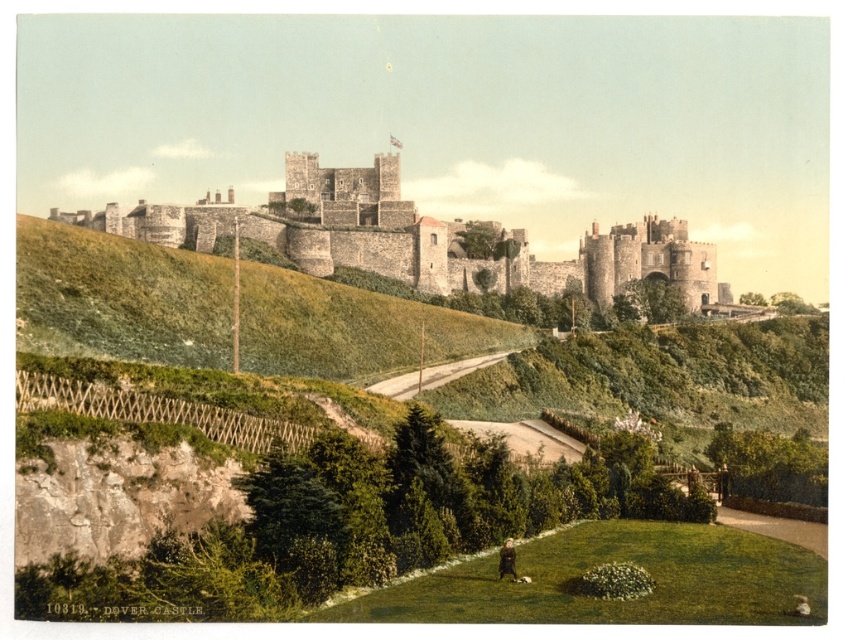
Is green grassy hillside at upper center behind stone castle at center?

No, it is not.

Who is higher up, green grassy hillside at upper center or stone castle at center?

Positioned higher is stone castle at center.

Identify the location of green grassy hillside at upper center. (120, 298).

Locate an element on the screen. green grassy hillside at upper center is located at coordinates (120, 298).

Can you confirm if green grassy hillside at upper center is taller than brown fur dog at lower center?

Indeed, green grassy hillside at upper center has a greater height compared to brown fur dog at lower center.

This screenshot has width=848, height=640. What do you see at coordinates (120, 298) in the screenshot? I see `green grassy hillside at upper center` at bounding box center [120, 298].

This screenshot has width=848, height=640. Find the location of `green grassy hillside at upper center`. green grassy hillside at upper center is located at coordinates (120, 298).

Image resolution: width=848 pixels, height=640 pixels. Find the location of `green grassy hillside at upper center`. green grassy hillside at upper center is located at coordinates (120, 298).

Is stone castle at center to the left of brown fur dog at lower center from the viewer's perspective?

Correct, you'll find stone castle at center to the left of brown fur dog at lower center.

Which is below, stone castle at center or brown fur dog at lower center?

brown fur dog at lower center is lower down.

The width and height of the screenshot is (848, 640). Find the location of `stone castle at center`. stone castle at center is located at coordinates (417, 237).